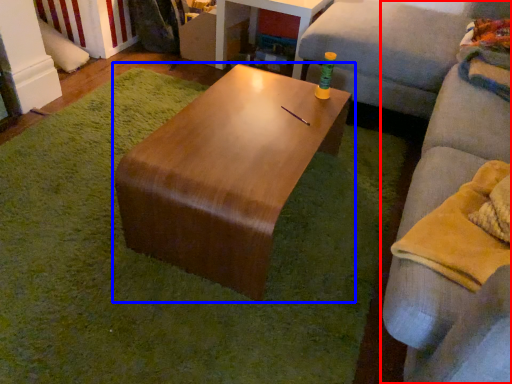
Question: Which of the following is the closest to the observer, studio couch (highlighted by a red box) or coffee table (highlighted by a blue box)?

Choices:
 (A) studio couch
 (B) coffee table

Answer: (A)